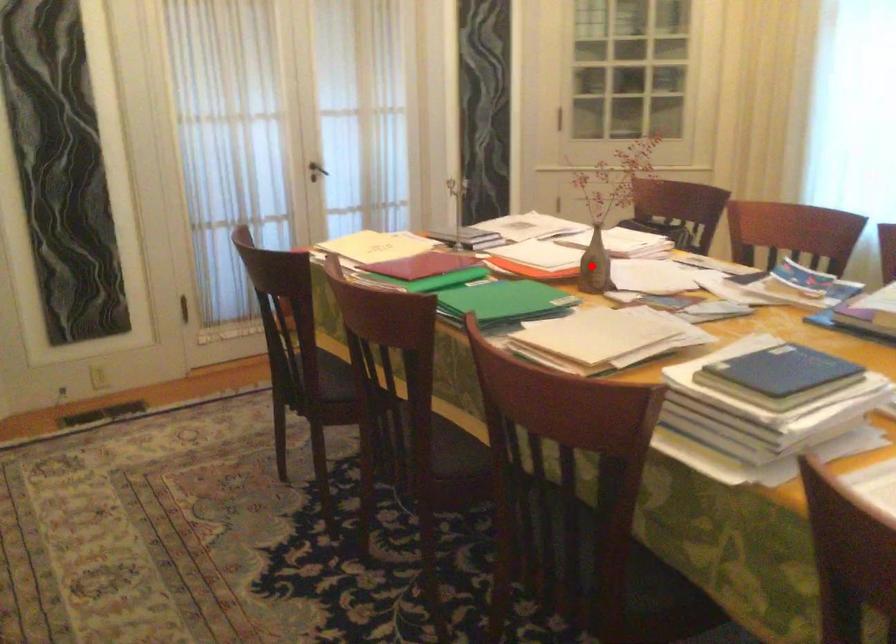
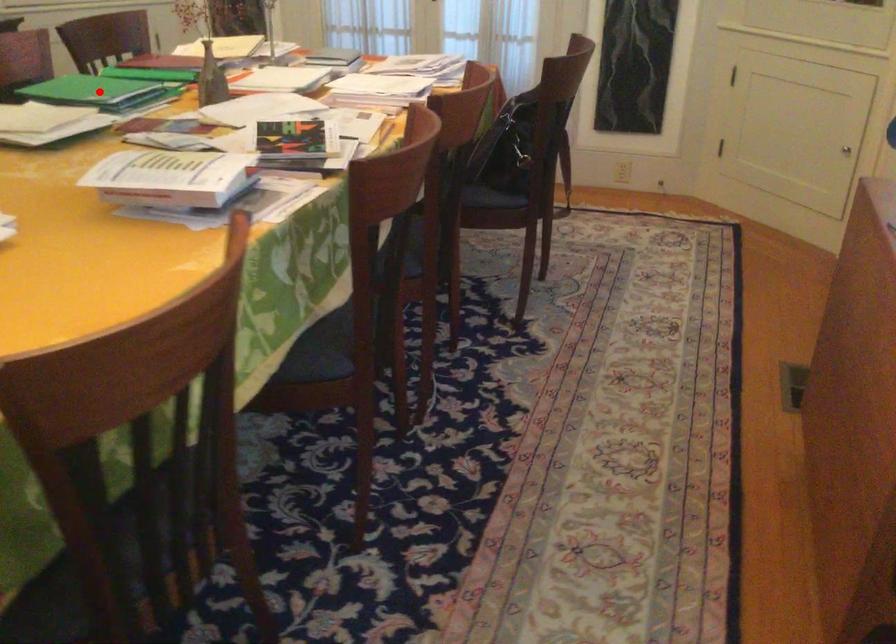
I am providing you with two images of the same scene from different viewpoints. A red point is marked on the first image and another point is marked on the second image. Are the points marked in image1 and image2 representing the same 3D position?

No